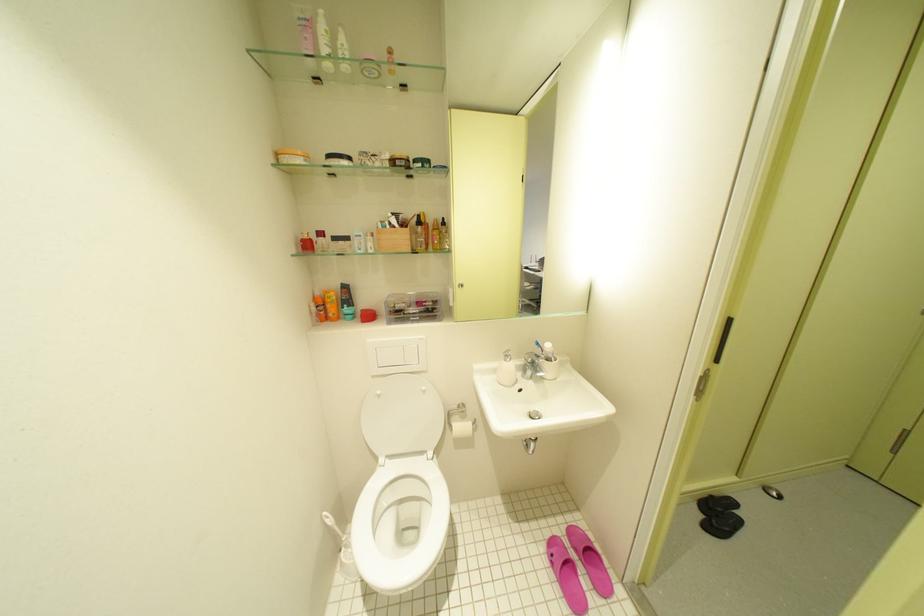
Find where to push the soap dispenser pump. Please return your answer as a coordinate pair (x, y).

(506, 352)